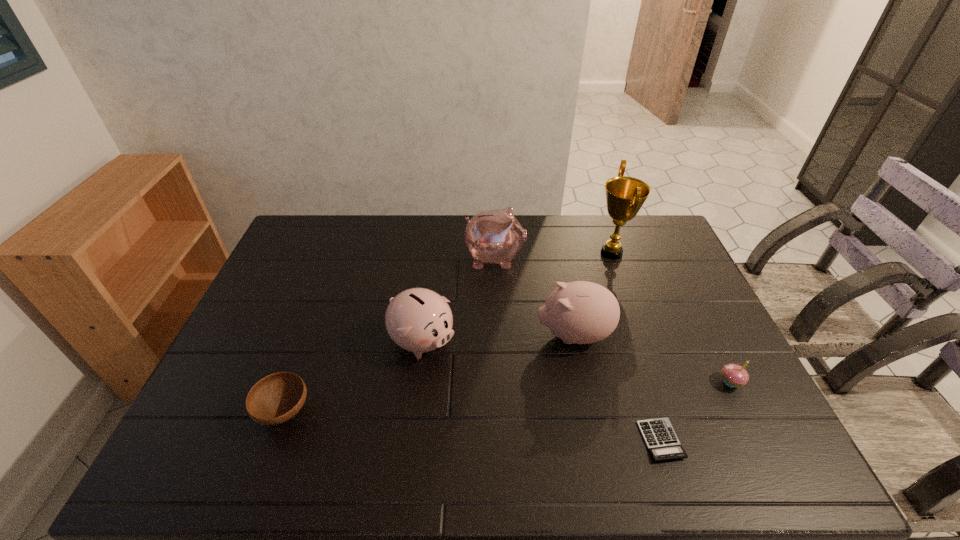
Identify the location of the sixth closest object to the leftmost object. (734, 375).

This screenshot has width=960, height=540. Identify the location of object that stands as the third closest to the tallest object. (734, 375).

Image resolution: width=960 pixels, height=540 pixels. Identify the location of piggy bank that is the second closest to the sixth object from right to left. (581, 312).

Locate an element on the screen. the closest piggy bank to the shortest object is located at coordinates (581, 312).

Find the location of a particular element. free space that satisfies the following two spatial constraints: 1. on the front view with handles of the third shortest object; 2. on the left side of the award is located at coordinates (657, 382).

The image size is (960, 540). I want to click on free point that satisfies the following two spatial constraints: 1. on the front view with handles of the award; 2. on the back side of the third shortest object, so click(x=657, y=382).

This screenshot has height=540, width=960. I want to click on blank space that satisfies the following two spatial constraints: 1. at the snout of the rightmost piggy bank; 2. on the right side of the shortest object, so click(x=595, y=440).

At what (x,y) coordinates should I click in order to perform the action: click on vacant region that satisfies the following two spatial constraints: 1. at the snout of the rightmost piggy bank; 2. on the front side of the second shortest object. Please return your answer as a coordinate pair (x, y). This screenshot has height=540, width=960. Looking at the image, I should click on (589, 411).

In order to click on vacant space that satisfies the following two spatial constraints: 1. at the snout of the rightmost piggy bank; 2. on the front side of the leftmost piggy bank in this screenshot , I will do `click(575, 341)`.